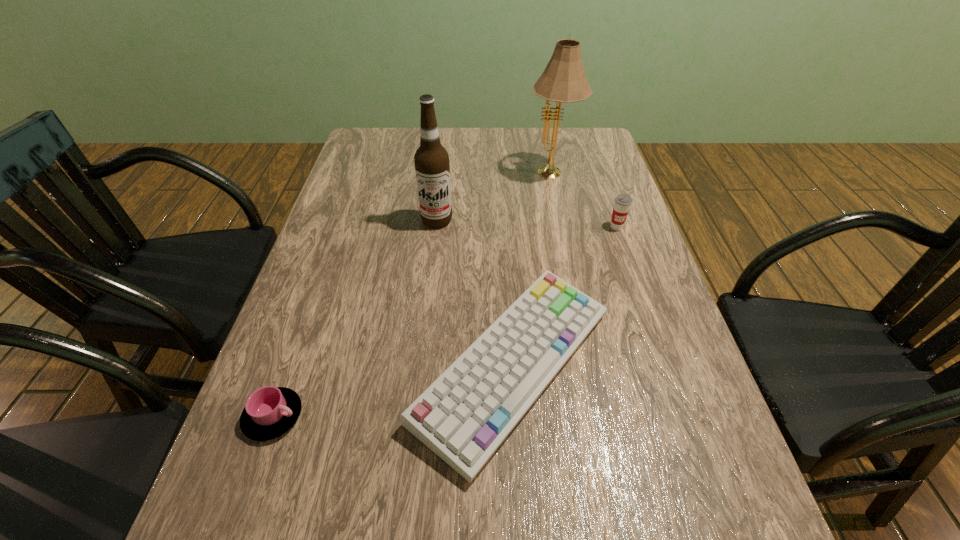
Locate an element on the screen. The height and width of the screenshot is (540, 960). vacant space located 0.120m on the side of the taller cup with the logo is located at coordinates (629, 264).

Identify the location of vacant space located 0.220m on the left of the computer keyboard. (299, 366).

What are the coordinates of `blank space located on the side with the handle of the nearer cup` in the screenshot? It's located at (379, 416).

Where is `object at the far edge`? This screenshot has width=960, height=540. object at the far edge is located at coordinates (563, 81).

Where is `object positioned at the left edge`? object positioned at the left edge is located at coordinates (269, 412).

Identify the location of lampshade located at the right edge. (563, 81).

You are a GUI agent. You are given a task and a screenshot of the screen. Output one action in this format:
    pyautogui.click(x=<x>, y=<y>)
    Task: Click on the cup present at the right edge
    
    Given the screenshot: What is the action you would take?
    pyautogui.click(x=622, y=202)

The height and width of the screenshot is (540, 960). I want to click on computer keyboard positioned at the right edge, so click(x=464, y=416).

Where is `object at the far right corner`? The width and height of the screenshot is (960, 540). object at the far right corner is located at coordinates (563, 81).

Find the location of a particular element. The width and height of the screenshot is (960, 540). vacant space at the far edge is located at coordinates (410, 157).